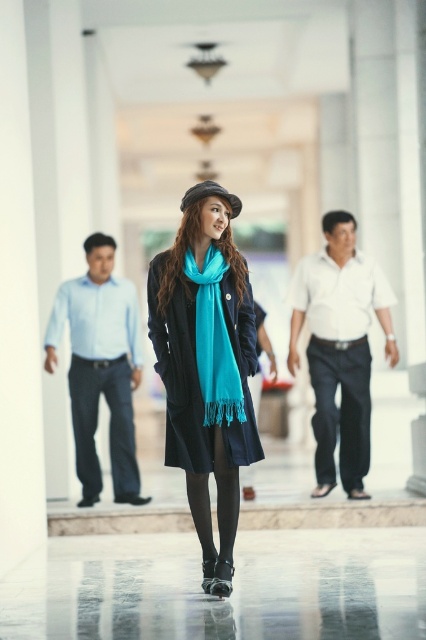
You are standing in the corridor and see a woman wearing a light blue shirt at left and a teal silk scarf at center. Which item is positioned closer to the left side of the corridor?

The light blue shirt at left is positioned closer to the left side of the corridor as it is to the left of the teal silk scarf at center.

You are a fashion designer observing the denim pants at left and the matte black hat at center in the image. Which item of clothing would require more fabric to produce? Explain your reasoning based on their sizes as shown in the scene.

The denim pants at left would require more fabric to produce because they are larger in size than the matte black hat at center, as shown in the scene.

You are an observer standing in the corridor. You notice the denim pants at left and the matte black hat at center. Which object appears taller in the image?

The denim pants at left appears taller than the matte black hat at center according to the description.